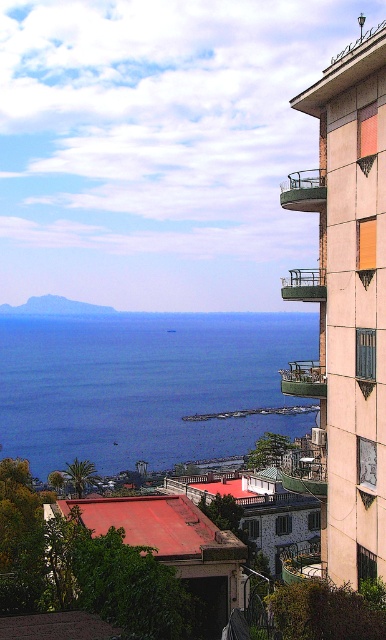
Question: Which point appears farthest from the camera in this image?

Choices:
 (A) (253, 314)
 (B) (282, 296)

Answer: (A)

Question: Which of the following is the closest to the observer?

Choices:
 (A) (284, 285)
 (B) (316, 182)

Answer: (B)

Question: Based on their relative distances, which object is nearer to the green metal balcony at upper right?

Choices:
 (A) metallic balcony at upper right
 (B) blue water at lower left

Answer: (A)

Question: Can you confirm if blue water at lower left is positioned to the right of metallic balcony at upper right?

Choices:
 (A) no
 (B) yes

Answer: (A)

Question: Is the position of blue water at lower left more distant than that of green metal balcony at upper right?

Choices:
 (A) no
 (B) yes

Answer: (B)

Question: Observing the image, what is the correct spatial positioning of blue water at lower left in reference to green metal balcony at upper right?

Choices:
 (A) left
 (B) right

Answer: (A)